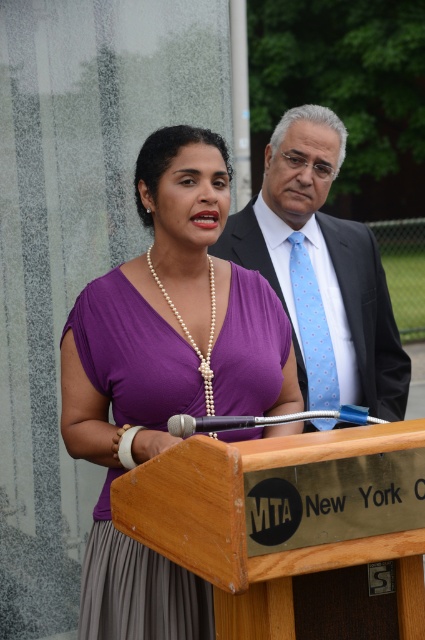
Question: Is dark gray suit at center positioned behind blue dotted tie at center?

Choices:
 (A) yes
 (B) no

Answer: (B)

Question: Does purple satin dress at center have a smaller size compared to blue dotted tie at center?

Choices:
 (A) no
 (B) yes

Answer: (A)

Question: Which is nearer to the blue dotted tie at center?

Choices:
 (A) purple satin dress at center
 (B) pearl necklace at center
 (C) dark gray suit at center

Answer: (C)

Question: Which object is the closest to the dark gray suit at center?

Choices:
 (A) blue dotted tie at center
 (B) pearl necklace at center

Answer: (A)

Question: Where is dark gray suit at center located in relation to pearl necklace at center in the image?

Choices:
 (A) above
 (B) below

Answer: (A)

Question: Which is nearer to the blue dotted tie at center?

Choices:
 (A) purple satin dress at center
 (B) dark gray suit at center

Answer: (B)